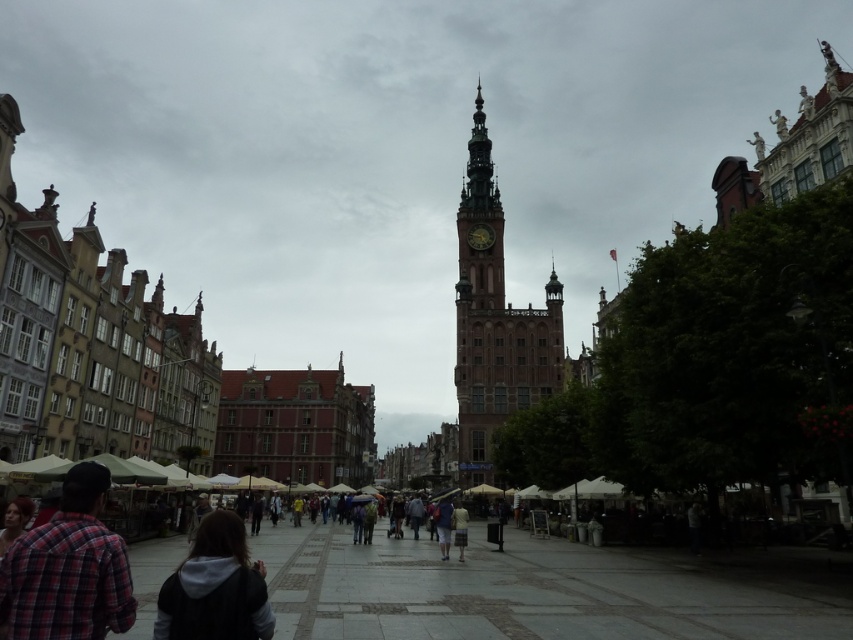
Is plaid shirt at lower left below dark gray hoodie at lower center?

No.

The height and width of the screenshot is (640, 853). In order to click on plaid shirt at lower left in this screenshot , I will do `click(68, 570)`.

At what (x,y) coordinates should I click in order to perform the action: click on plaid shirt at lower left. Please return your answer as a coordinate pair (x, y). This screenshot has height=640, width=853. Looking at the image, I should click on (68, 570).

Can you confirm if golden stone clock tower at center is positioned to the left of dark gray hoodie at lower center?

In fact, golden stone clock tower at center is to the right of dark gray hoodie at lower center.

Based on the photo, does golden stone clock tower at center have a greater height compared to dark gray hoodie at lower center?

Yes, golden stone clock tower at center is taller than dark gray hoodie at lower center.

Between point (463, 280) and point (231, 577), which one is positioned in front?

Point (231, 577)

The image size is (853, 640). I want to click on golden stone clock tower at center, so click(494, 321).

Can you confirm if golden stone clock tower at center is smaller than plaid shirt at lower left?

No, golden stone clock tower at center is not smaller than plaid shirt at lower left.

This screenshot has width=853, height=640. In order to click on golden stone clock tower at center in this screenshot , I will do `click(494, 321)`.

Locate an element on the screen. golden stone clock tower at center is located at coordinates pyautogui.click(x=494, y=321).